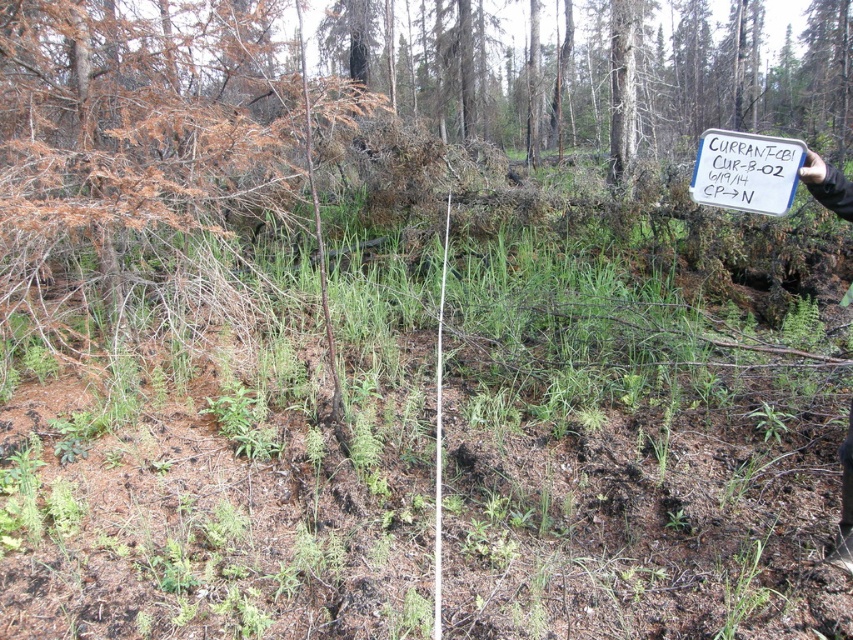
You are a researcher in the forest and need to place a new sign that is 1 meter tall. You see the white paper sign at upper right and the white plastic sign at upper right. Which existing sign can the new sign be placed next to without exceeding the height of the other sign?

The white paper sign at upper right has a lesser height compared to white plastic sign at upper right. Therefore, the new 1 meter tall sign can be placed next to the white plastic sign at upper right if it is taller than 1 meter, but since the paper sign is shorter, placing it next to the paper sign may not be advisable unless the new sign is shorter. However, based on the given information, the white plastic sign is taller, so the new sign can be placed next to it if it is at least as tall as the new sign.

You are a researcher in the forest and need to read both the white paper sign at upper right and the white plastic sign at upper right. Which sign is easier to see from your current position?

The white paper sign at upper right is positioned over the white plastic sign at upper right, so the white paper sign at upper right is easier to see because it is in front.

You are a researcher in the forest and need to locate both the white paper sign at upper right and the white plastic sign at upper right. According to the scene, which sign is positioned more to the left?

The white paper sign at upper right is positioned more to the left than the white plastic sign at upper right.